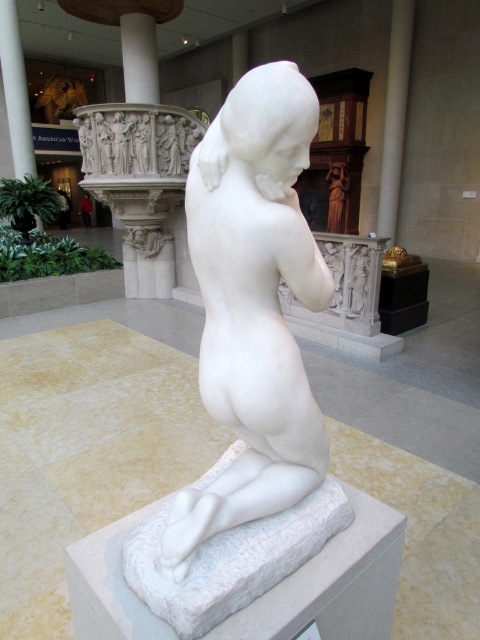
You are standing in the museum and see two points marked in the image. The first point is at coordinates point (286,189) and the second is at point (386,99). Which point is closer to you?

Point (286,189) is in front of point (386,99), so the first point is closer to you.

In the scene shown: You are a tour guide leading a group through the museum. You want to ensure visitors can easily view both the white marble statue at center and the white marble pillar at center without obstruction. Given that the average person is 1.7 meters tall, is there enough space between the two objects for visitors to walk around them comfortably?

The white marble statue at center is 11.16 meters from the white marble pillar at center. Since the distance between them is significantly larger than the average person height of 1.7 meters, there is ample space for visitors to walk around both objects comfortably without obstruction.

You are standing in the museum and want to take a photo of the point at coordinates (x=409, y=24). If your camera has a maximum focus range of 10 meters, will it be able to focus on that point?

The point at coordinates (x=409, y=24) is 11.06 meters away from the viewer. Since the camera can only focus up to 10 meters, it will not be able to focus on that point.